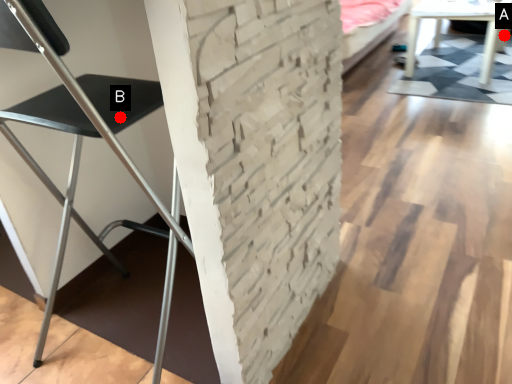
Question: Two points are circled on the image, labeled by A and B beside each circle. Which point is further to the camera?

Choices:
 (A) A is further
 (B) B is further

Answer: (A)